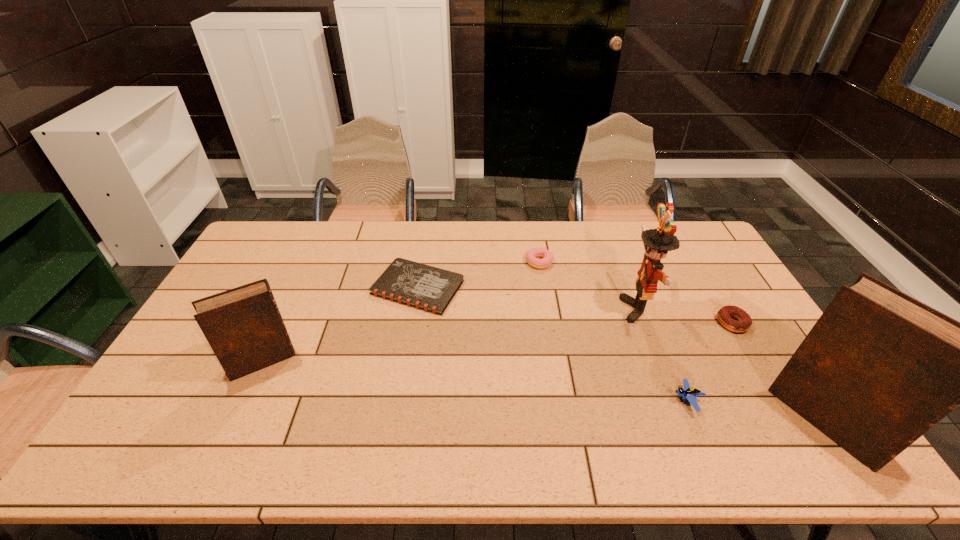
Locate an element on the screen. This screenshot has height=540, width=960. the fifth shortest object is located at coordinates (244, 327).

The height and width of the screenshot is (540, 960). Identify the location of the leftmost object. (244, 327).

Locate an element on the screen. the right Bible is located at coordinates (879, 368).

The width and height of the screenshot is (960, 540). I want to click on the right doughnut, so click(x=724, y=315).

This screenshot has width=960, height=540. I want to click on the left doughnut, so click(547, 257).

Image resolution: width=960 pixels, height=540 pixels. Identify the location of the farther doughnut. (547, 257).

Find the location of a particular element. The image size is (960, 540). notebook is located at coordinates (425, 287).

The height and width of the screenshot is (540, 960). I want to click on the sixth object from right to left, so click(x=425, y=287).

This screenshot has height=540, width=960. What are the coordinates of `nutcracker` in the screenshot? It's located at (657, 242).

Find the location of `the fourth shortest object`. the fourth shortest object is located at coordinates (689, 392).